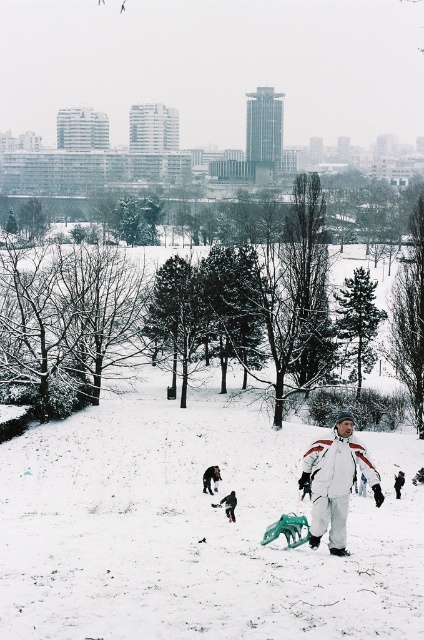
Is dark gray snowsuit at lower center to the left of white snowsuit at center from the viewer's perspective?

Yes, dark gray snowsuit at lower center is to the left of white snowsuit at center.

Can you confirm if dark gray snowsuit at lower center is smaller than white snowsuit at center?

Actually, dark gray snowsuit at lower center might be larger than white snowsuit at center.

I want to click on dark gray snowsuit at lower center, so (229, 506).

Measure the distance between dark fur coat at lower center and camera.

dark fur coat at lower center and camera are 35.32 meters apart from each other.

Which is behind, point (203, 486) or point (229, 497)?

Point (203, 486)

Describe the element at coordinates (211, 477) in the screenshot. I see `dark fur coat at lower center` at that location.

At what (x,y) coordinates should I click in order to perform the action: click on dark fur coat at lower center. Please return your answer as a coordinate pair (x, y). The image size is (424, 640). Looking at the image, I should click on (211, 477).

Does white matte snowsuit at center have a greater width compared to white snowsuit at center?

Correct, the width of white matte snowsuit at center exceeds that of white snowsuit at center.

Does white matte snowsuit at center come in front of white snowsuit at center?

Yes, white matte snowsuit at center is in front of white snowsuit at center.

Who is more distant from viewer, (321,524) or (401,486)?

Positioned behind is point (401,486).

Where is `white matte snowsuit at center`? The image size is (424, 640). white matte snowsuit at center is located at coordinates (335, 481).